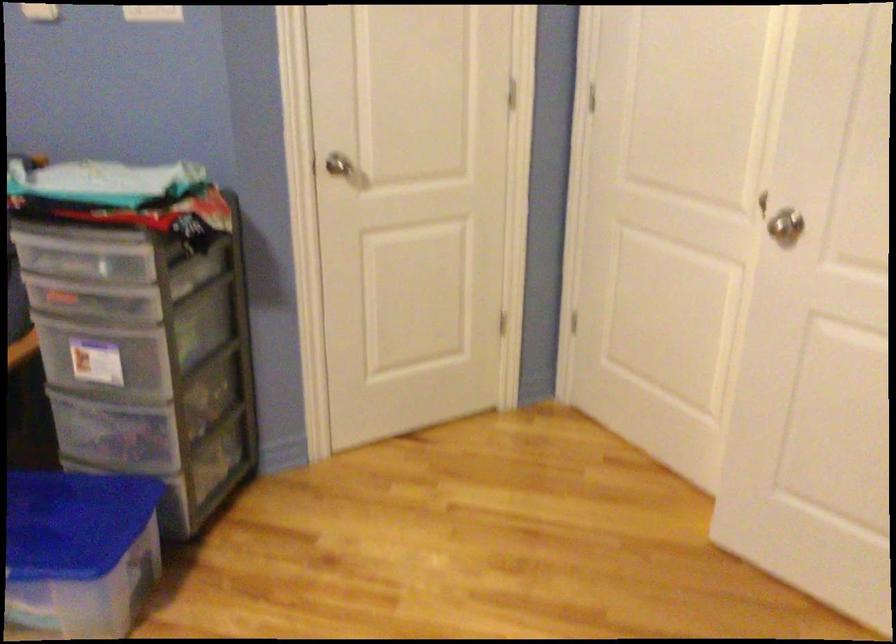
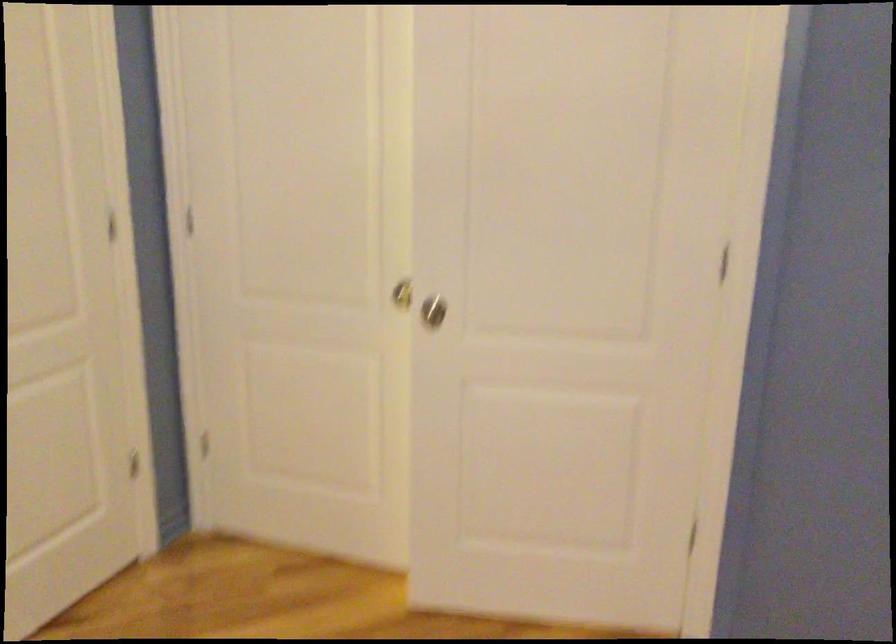
Locate, in the second image, the point that corresponds to point (780, 190) in the first image.

(401, 292)